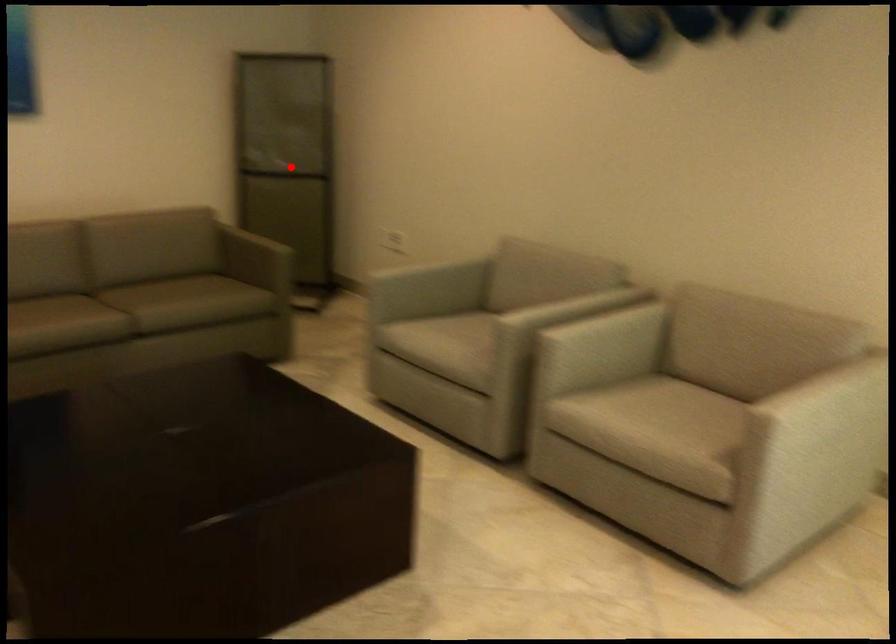
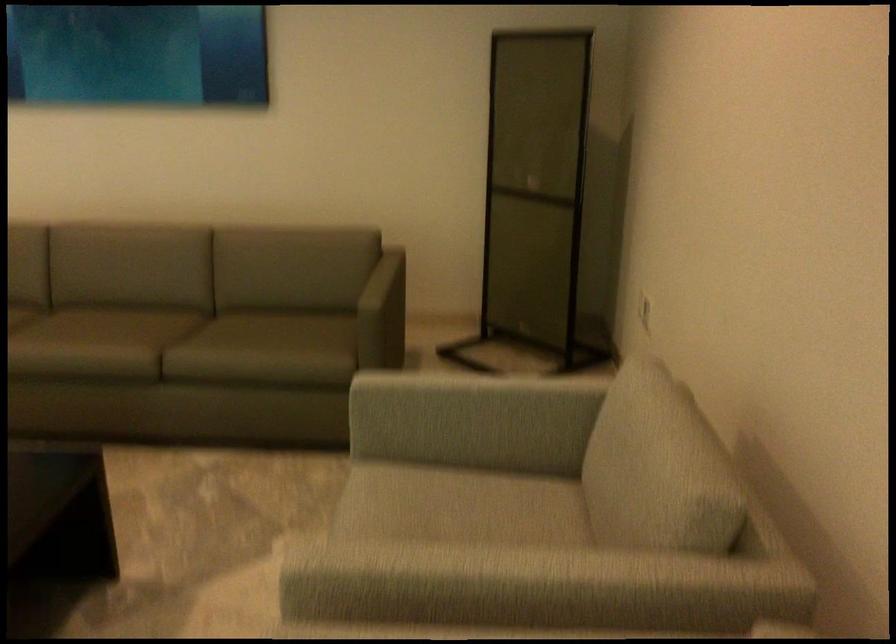
In the second image, find the point that corresponds to the highlighted location in the first image.

(536, 194)